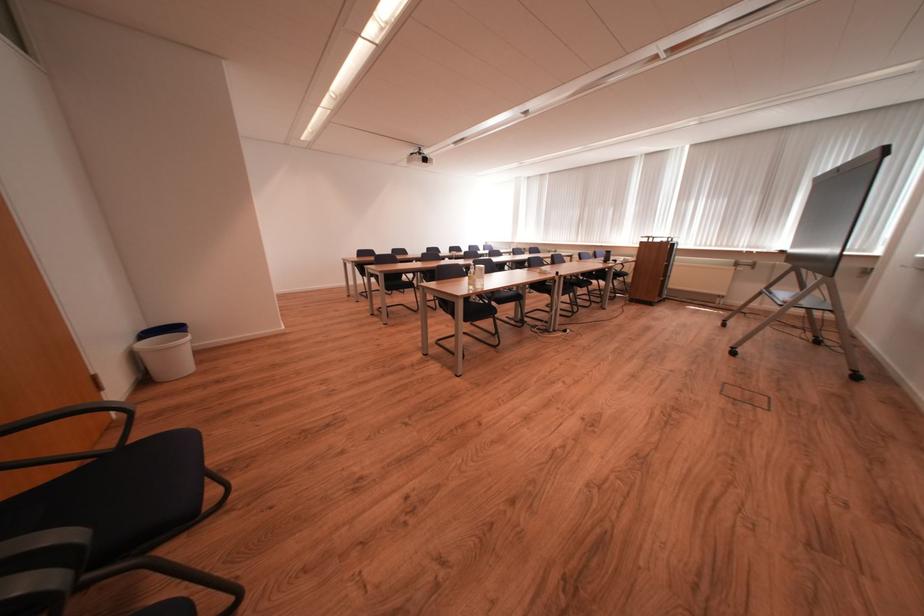
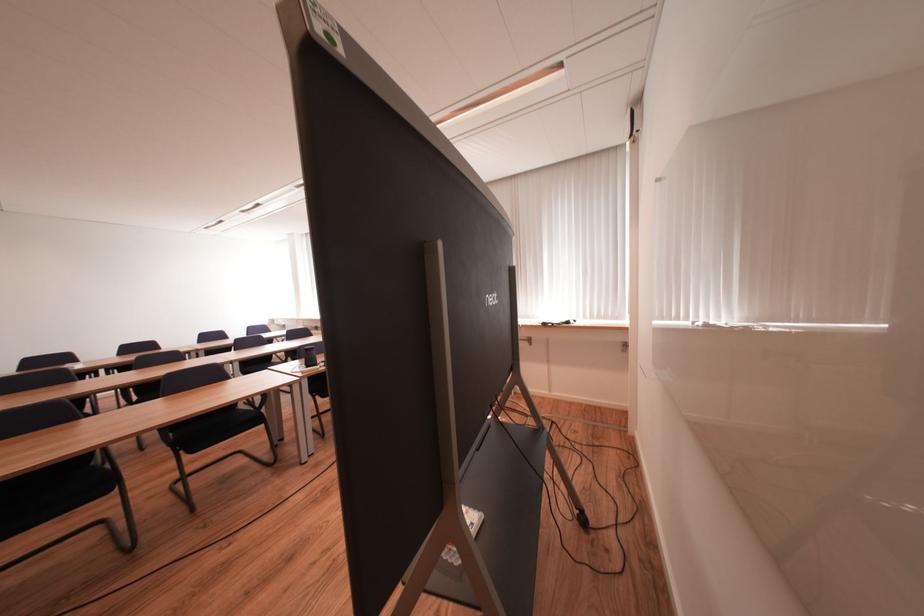
Which direction would the cameraman need to move to produce the second image?

The cameraman walked toward right, forward.